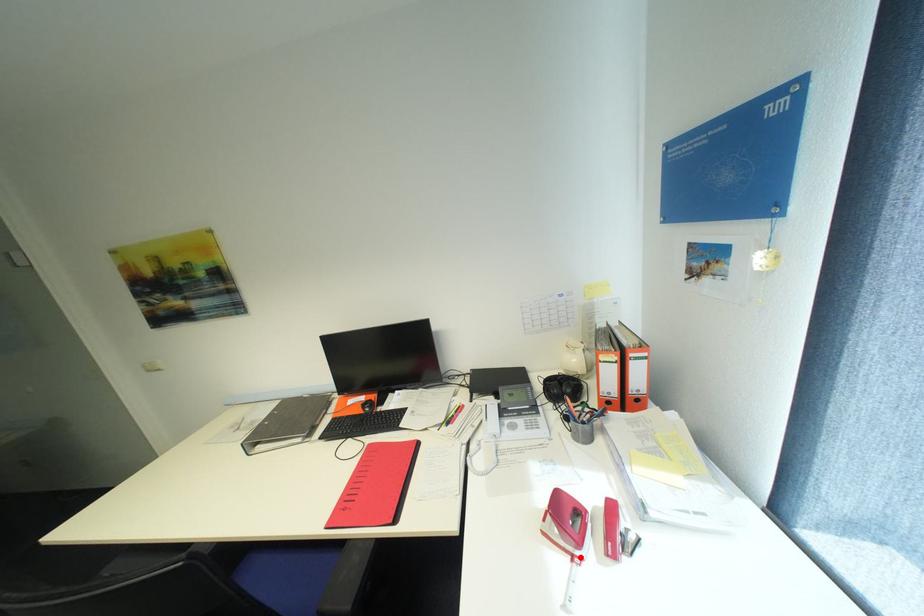
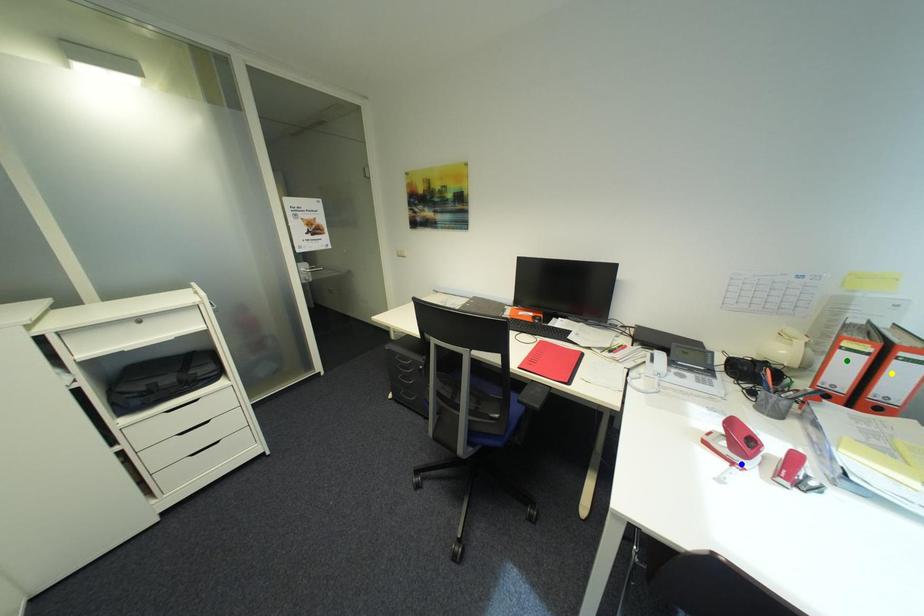
Question: I am providing you with two images of the same scene from different viewpoints. A red point is marked on the first image. You are given multiple points on the second image. In image 2, which mark is for the same physical point as the one in image 1?

Choices:
 (A) yellow point
 (B) blue point
 (C) green point

Answer: (B)